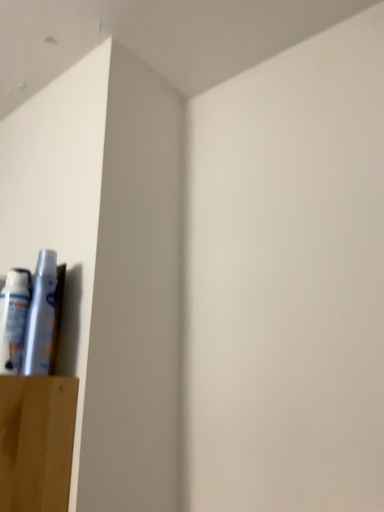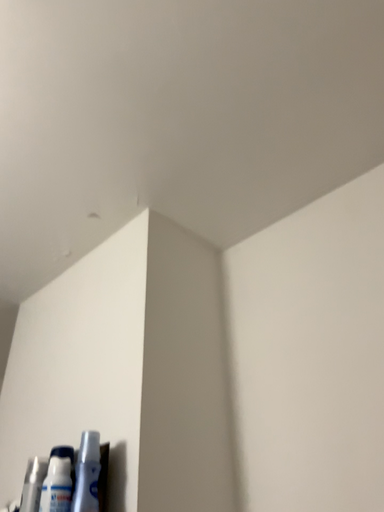
Question: Which way did the camera rotate in the video?

Choices:
 (A) rotated upward
 (B) rotated downward

Answer: (A)